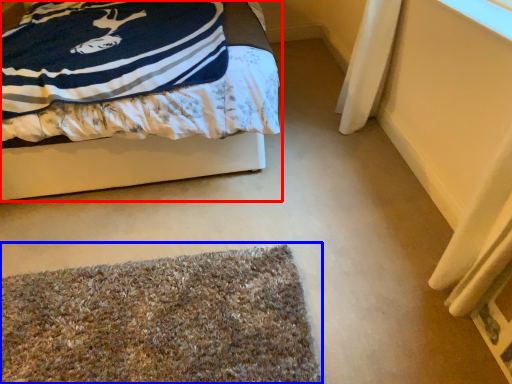
Question: Which point is further to the camera, bed (highlighted by a red box) or mat (highlighted by a blue box)?

Choices:
 (A) bed
 (B) mat

Answer: (A)